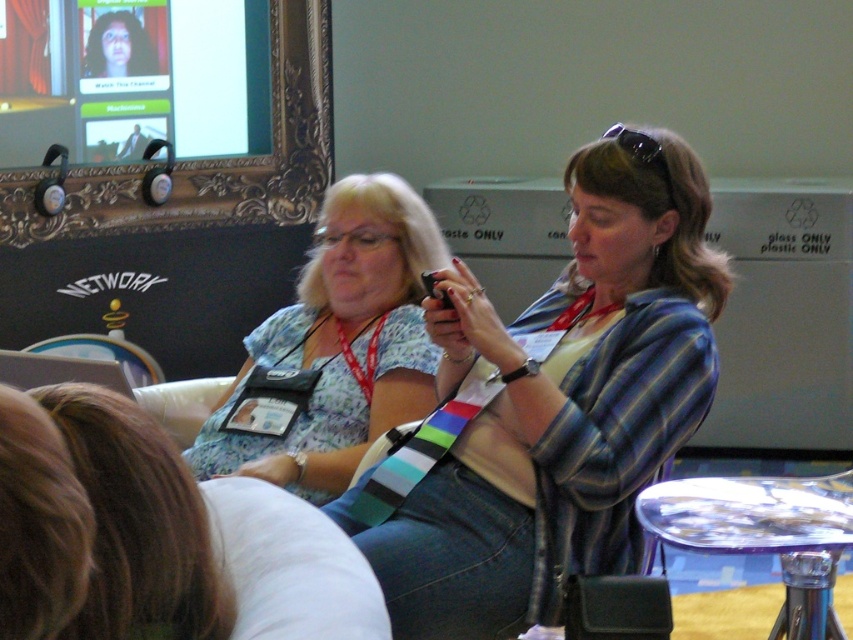
You are a photographer standing at the camera position. You want to take a photo of the brown hair at lower left. However, there is a rule that the photographer must be at least 1.2 meters away from the subject to avoid blurring. Do you think you can take a clear photo without moving closer?

The distance between the brown hair at lower left and the camera is 1.05 meters, which is less than the required 1.2 meters. Therefore, you cannot take a clear photo without moving closer.

You are a fashion designer observing two women at a conference. You notice the striped fabric shirt at center and the floral fabric blouse at center. Which one has a larger size?

The striped fabric shirt at center is bigger than the floral fabric blouse at center.